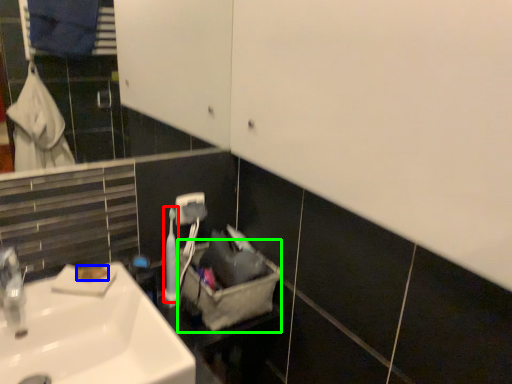
Question: Which object is the farthest from toiletry (highlighted by a red box)? Choose among these: soap (highlighted by a blue box) or laundry basket (highlighted by a green box).

Choices:
 (A) soap
 (B) laundry basket

Answer: (A)